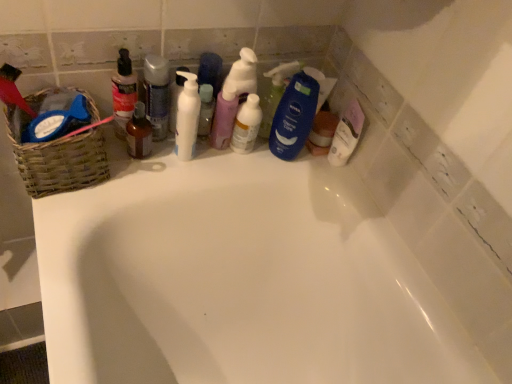
The image size is (512, 384). Find the location of `free spot in front of woven brown basket at left`. free spot in front of woven brown basket at left is located at coordinates (65, 228).